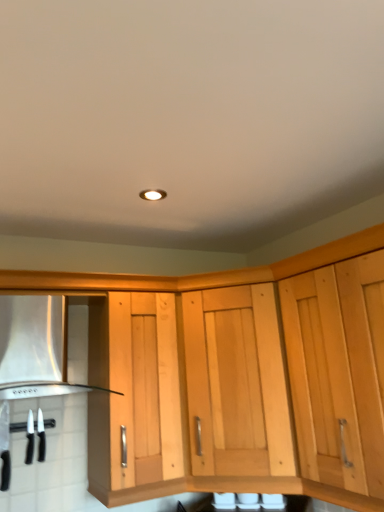
Question: Is black plastic knife at lower left, placed as the second kitchen appliance when sorted from left to right, wider or thinner than natural wood cabinet at center?

Choices:
 (A) wide
 (B) thin

Answer: (B)

Question: Is black plastic knife at lower left, placed as the second kitchen appliance when sorted from left to right, in front of or behind natural wood cabinet at center in the image?

Choices:
 (A) front
 (B) behind

Answer: (B)

Question: Estimate the real-world distances between objects in this image. Which object is closer to the natural wood cabinet at center?

Choices:
 (A) matte white recessed light at center
 (B) black plastic knife at lower left, the 1th kitchen appliance from the right
 (C) satin silver vent at lower left
 (D) black plastic knives at lower left, which is counted as the 1th kitchen appliance, starting from the left

Answer: (C)

Question: Which object is positioned closest to the black plastic knives at lower left, which is counted as the 1th kitchen appliance, starting from the left?

Choices:
 (A) satin silver vent at lower left
 (B) natural wood cabinet at center
 (C) matte white recessed light at center
 (D) black plastic knife at lower left, placed as the second kitchen appliance when sorted from left to right

Answer: (D)